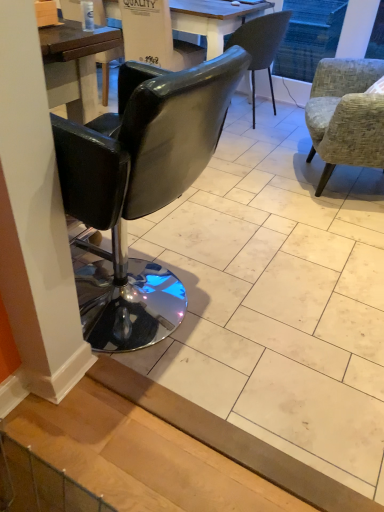
Question: From the image's perspective, is black leather armchair at center above or below textured gray fabric armchair at right, which ranks as the 3th chair in left-to-right order?

Choices:
 (A) above
 (B) below

Answer: (A)

Question: Is black leather armchair at center situated inside textured gray fabric armchair at right, which is counted as the 2th chair, starting from the back, or outside?

Choices:
 (A) outside
 (B) inside

Answer: (A)

Question: Which is nearer to the textured gray fabric armchair at right, which ranks as the 3th chair in left-to-right order?

Choices:
 (A) black leather chair at left, which is counted as the third chair, starting from the back
 (B) matte gray chair at center, acting as the 3th chair starting from the front
 (C) black leather armchair at center

Answer: (B)

Question: Which is nearer to the black leather armchair at center?

Choices:
 (A) textured gray fabric armchair at right, which is counted as the 2th chair, starting from the back
 (B) matte gray chair at center, marked as the 2th chair in a left-to-right arrangement
 (C) black leather chair at left, marked as the first chair in a front-to-back arrangement

Answer: (B)